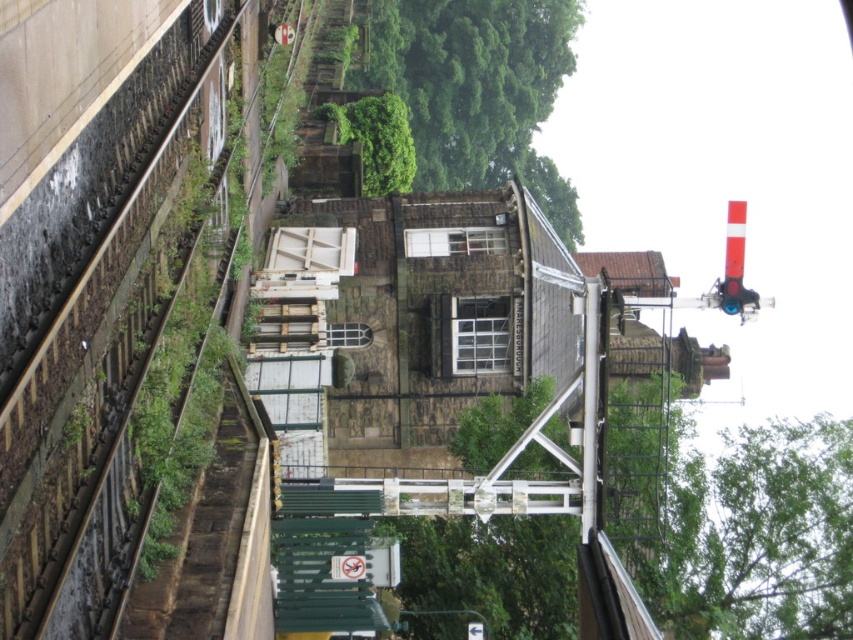
Looking at this image, does brown stone train track at left have a lesser height compared to green leafy tree at center?

In fact, brown stone train track at left may be taller than green leafy tree at center.

Identify the location of brown stone train track at left. (x=103, y=310).

What are the coordinates of `brown stone train track at left` in the screenshot? It's located at (103, 310).

Does brown stone train track at left come behind green leafy tree at upper center?

That is False.

Between point (134, 234) and point (567, 20), which one is positioned in front?

Positioned in front is point (134, 234).

Describe the element at coordinates (103, 310) in the screenshot. I see `brown stone train track at left` at that location.

Locate an element on the screen. The width and height of the screenshot is (853, 640). brown stone train track at left is located at coordinates (103, 310).

Between green leafy tree at upper center and green leafy tree at center, which one appears on the right side from the viewer's perspective?

From the viewer's perspective, green leafy tree at upper center appears more on the right side.

The height and width of the screenshot is (640, 853). In order to click on green leafy tree at upper center in this screenshot , I will do `click(479, 90)`.